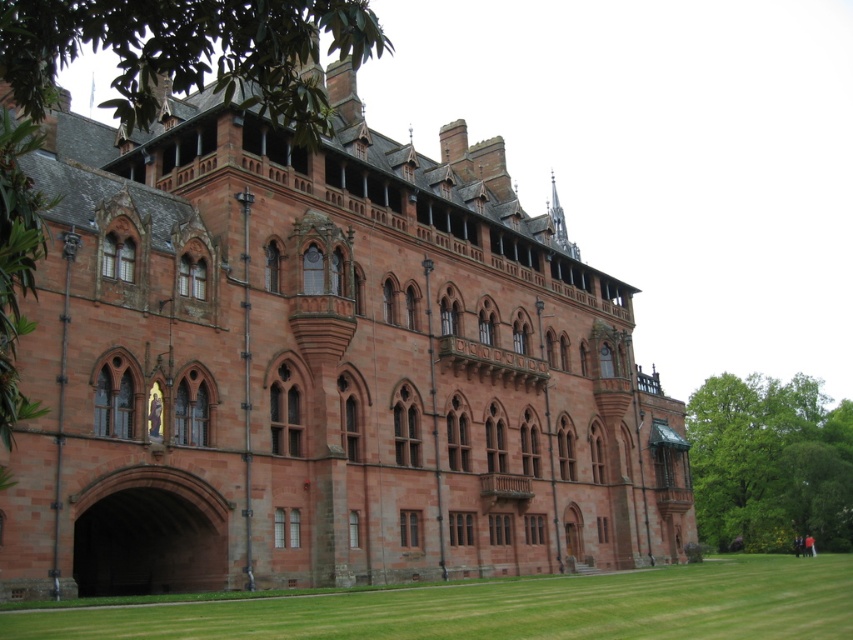
Question: Can you confirm if green grass at lower center is bigger than green leafy tree at lower right?

Choices:
 (A) no
 (B) yes

Answer: (A)

Question: Among these objects, which one is farthest from the camera?

Choices:
 (A) green leafy tree at upper center
 (B) green grass at lower center
 (C) green leafy tree at lower right

Answer: (C)

Question: Does green leafy tree at upper center have a greater width compared to green leafy tree at lower right?

Choices:
 (A) yes
 (B) no

Answer: (A)

Question: Among these objects, which one is nearest to the camera?

Choices:
 (A) green leafy tree at upper center
 (B) green grass at lower center

Answer: (A)

Question: Based on their relative distances, which object is nearer to the green leafy tree at lower right?

Choices:
 (A) green leafy tree at upper center
 (B) green grass at lower center

Answer: (B)

Question: Where is green grass at lower center located in relation to green leafy tree at lower right in the image?

Choices:
 (A) below
 (B) above

Answer: (B)